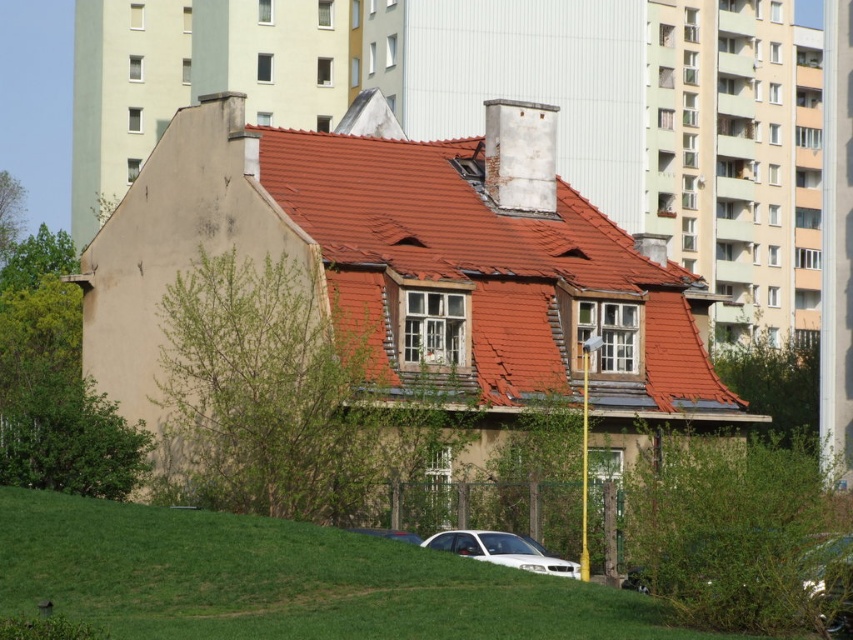
Between red tile roof at center and metallic silver car at lower center, which one appears on the right side from the viewer's perspective?

From the viewer's perspective, red tile roof at center appears more on the right side.

I want to click on red tile roof at center, so click(483, 273).

In the scene shown: Can you confirm if red tile roof at center is positioned to the left of green grass at lower center?

In fact, red tile roof at center is to the right of green grass at lower center.

Is point (490, 280) in front of point (351, 598)?

No, it is not.

Locate an element on the screen. red tile roof at center is located at coordinates (483, 273).

Can you confirm if red tile roof at center is shorter than white glossy car at lower center?

No.

Describe the element at coordinates (483, 273) in the screenshot. I see `red tile roof at center` at that location.

Who is more distant from viewer, [289,189] or [517,552]?

Point [289,189]

Locate an element on the screen. The width and height of the screenshot is (853, 640). red tile roof at center is located at coordinates (483, 273).